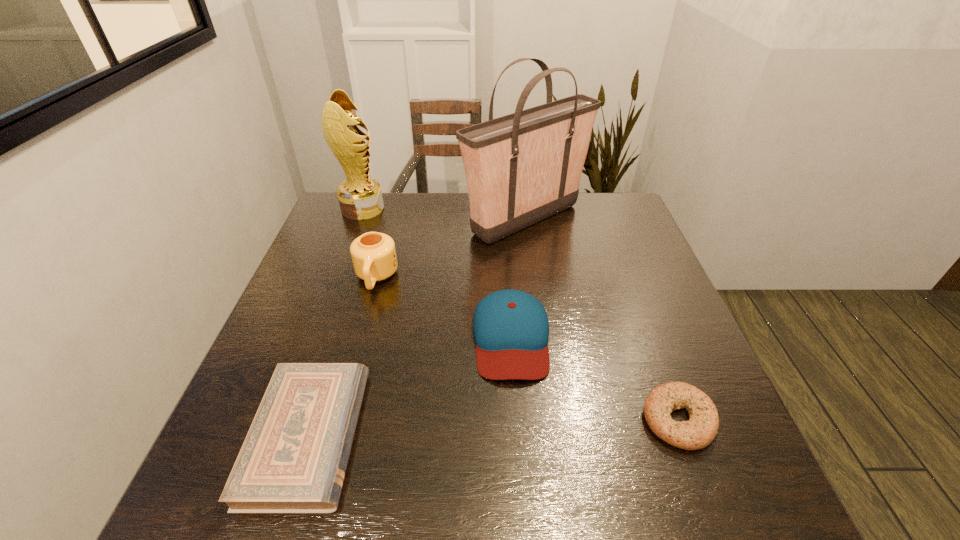
The height and width of the screenshot is (540, 960). I want to click on vacant space located with the bill of the baseball cap facing forward, so click(x=521, y=482).

You are a GUI agent. You are given a task and a screenshot of the screen. Output one action in this format:
    pyautogui.click(x=<x>, y=<y>)
    Task: Click on the free space located 0.340m on the left of the bagel
    The image size is (960, 540).
    Given the screenshot: What is the action you would take?
    pyautogui.click(x=466, y=420)

Where is `vacant space located on the spine side of the Bible`? vacant space located on the spine side of the Bible is located at coordinates (448, 436).

This screenshot has height=540, width=960. Identify the location of shopping bag present at the far edge. (522, 168).

Where is `award positioned at the far edge`? award positioned at the far edge is located at coordinates (360, 197).

Identify the location of object present at the near edge. The width and height of the screenshot is (960, 540). (293, 460).

I want to click on award present at the left edge, so click(x=360, y=197).

Where is `mug located in the left edge section of the desktop`? mug located in the left edge section of the desktop is located at coordinates (373, 254).

At what (x,y) coordinates should I click in order to perform the action: click on Bible that is positioned at the left edge. Please return your answer as a coordinate pair (x, y). This screenshot has width=960, height=540. Looking at the image, I should click on (293, 460).

Find the location of a particular element. This screenshot has width=960, height=540. shopping bag that is at the right edge is located at coordinates (522, 168).